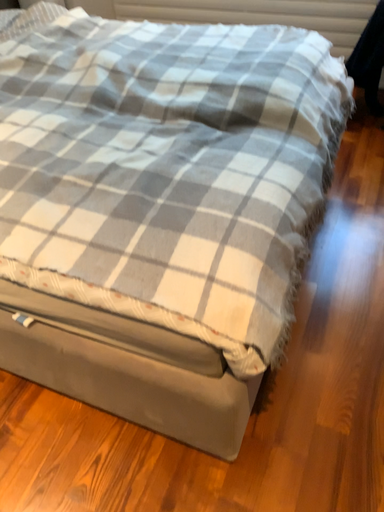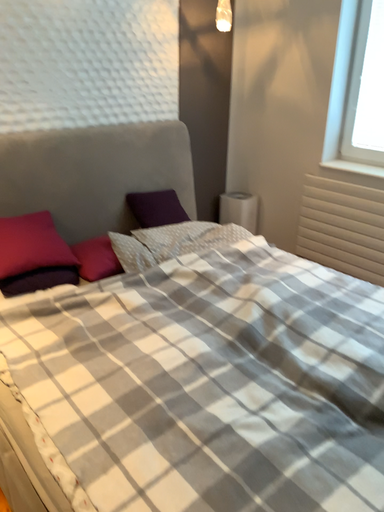
Question: Which way did the camera rotate in the video?

Choices:
 (A) rotated left
 (B) rotated right

Answer: (A)